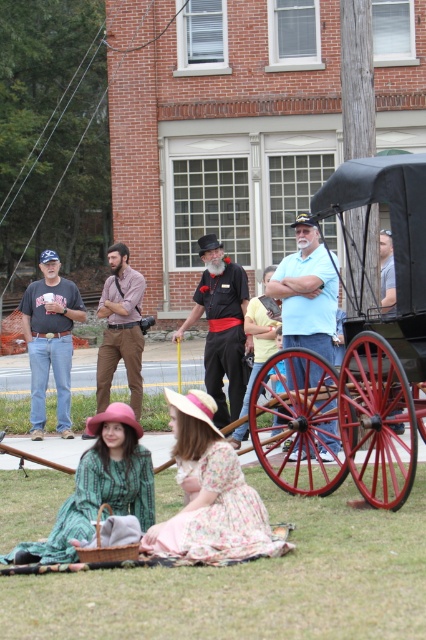
Question: Which point is closer to the camera?

Choices:
 (A) blue cotton shirt at center
 (B) green grass at lower center
 (C) floral fabric dress at center

Answer: (B)

Question: Which object appears farthest from the camera in this image?

Choices:
 (A) brown leather coach at center
 (B) smooth brown leather jacket at center

Answer: (A)

Question: Where is blue cotton shirt at center located in relation to smooth brown leather jacket at center in the image?

Choices:
 (A) left
 (B) right

Answer: (A)

Question: In this image, where is black cotton shirt at center located relative to matte black cup at center?

Choices:
 (A) above
 (B) below

Answer: (A)

Question: From the image, what is the correct spatial relationship of matte black cup at center in relation to brown leather coach at center?

Choices:
 (A) above
 (B) below

Answer: (B)

Question: Which point is farther to the camera?

Choices:
 (A) (400, 260)
 (B) (123, 272)
 (C) (55, 310)
 (D) (236, 616)

Answer: (B)